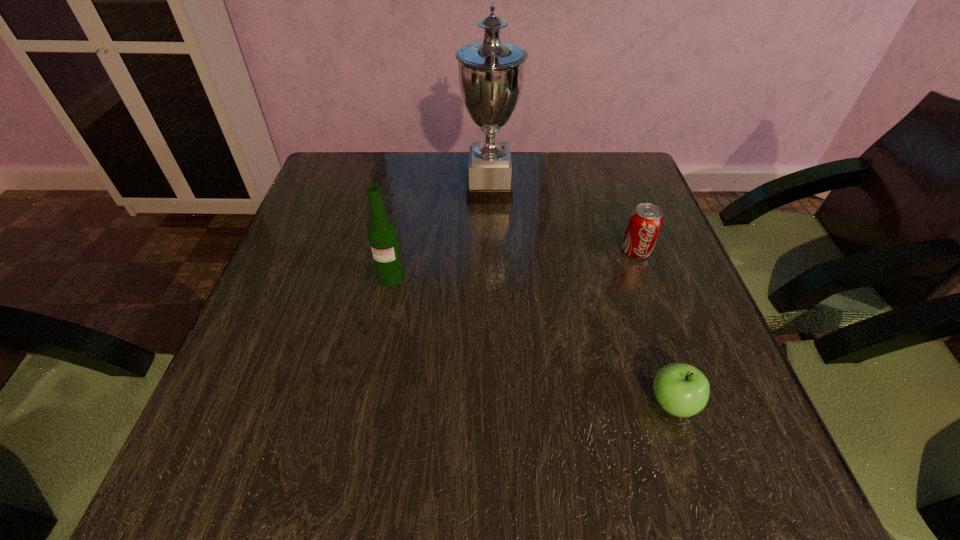
Where is `free point that satisfies the following two spatial constraints: 1. at the front view of the shortest object; 2. on the right side of the farthest object`? This screenshot has width=960, height=540. free point that satisfies the following two spatial constraints: 1. at the front view of the shortest object; 2. on the right side of the farthest object is located at coordinates (494, 403).

Where is `vacant space that satisfies the following two spatial constraints: 1. at the front view of the soda; 2. on the left side of the second object from left to right`? The width and height of the screenshot is (960, 540). vacant space that satisfies the following two spatial constraints: 1. at the front view of the soda; 2. on the left side of the second object from left to right is located at coordinates (491, 251).

This screenshot has height=540, width=960. What are the coordinates of `free location that satisfies the following two spatial constraints: 1. at the front view of the trophy cup; 2. on the label of the second tallest object` in the screenshot? It's located at (492, 278).

Identify the location of free space in the image that satisfies the following two spatial constraints: 1. at the front view of the third object from right to left; 2. on the right side of the shortest object. (494, 403).